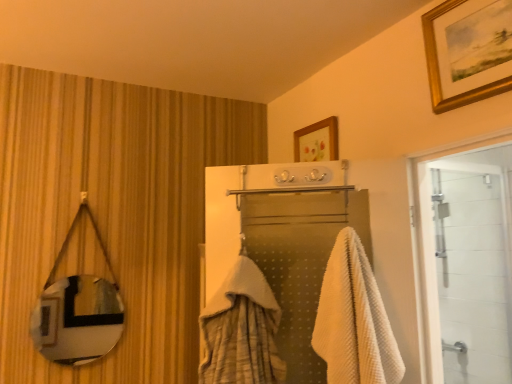
Locate an element on the screen. white glass door at right is located at coordinates (425, 244).

This screenshot has width=512, height=384. What do you see at coordinates (425, 244) in the screenshot? I see `white glass door at right` at bounding box center [425, 244].

What is the approximate width of gold-framed picture at upper right?

The width of gold-framed picture at upper right is 2.44 inches.

The height and width of the screenshot is (384, 512). Identify the location of white waffle towel at center. (354, 320).

Which is correct: white glass door at right is inside metallic reflective mirror at left, or outside of it?

The correct answer is: outside.

Is point (415, 291) less distant than point (88, 346)?

Yes, point (415, 291) is in front of point (88, 346).

Measure the distance from white glass door at right to metallic reflective mirror at left.

white glass door at right is 4.78 feet from metallic reflective mirror at left.

From the image's perspective, which one is positioned higher, white glass door at right or metallic reflective mirror at left?

From the image's view, white glass door at right is above.

Considering the relative sizes of white glass door at right and gold-framed picture at upper right in the image provided, is white glass door at right shorter than gold-framed picture at upper right?

In fact, white glass door at right may be taller than gold-framed picture at upper right.

From a real-world perspective, does white glass door at right sit lower than gold-framed picture at upper right?

Yes.

At what (x,y) coordinates should I click in order to perform the action: click on picture frame on the left of the white glass door at right. Please return your answer as a coordinate pair (x, y). Looking at the image, I should click on (454, 69).

Would you say metallic reflective mirror at left is part of white waffle towel at center's contents?

That's incorrect, metallic reflective mirror at left is not inside white waffle towel at center.

Which of these two, white waffle towel at center or metallic reflective mirror at left, is bigger?

With larger size is white waffle towel at center.

Is white waffle towel at center behind metallic reflective mirror at left?

That is False.

Is white waffle towel at center in contact with metallic reflective mirror at left?

They are not placed beside each other.

From a real-world perspective, between metallic reflective mirror at left and gold-framed picture at upper right, who is vertically lower?

metallic reflective mirror at left, from a real-world perspective.

From the image's perspective, is metallic reflective mirror at left under gold-framed picture at upper right?

Yes, from the image's perspective, metallic reflective mirror at left is beneath gold-framed picture at upper right.

Who is taller, metallic reflective mirror at left or gold-framed picture at upper right?

With more height is metallic reflective mirror at left.

Is metallic reflective mirror at left placed right next to gold-framed picture at upper right?

metallic reflective mirror at left is not next to gold-framed picture at upper right, and they're not touching.

From the picture: Considering the sizes of metallic reflective mirror at left and white waffle towel at center in the image, is metallic reflective mirror at left bigger or smaller than white waffle towel at center?

Considering their sizes, metallic reflective mirror at left takes up less space than white waffle towel at center.

Does metallic reflective mirror at left have a greater width compared to white waffle towel at center?

No.

Can you tell me how much metallic reflective mirror at left and white waffle towel at center differ in facing direction?

35.2 degrees separate the facing orientations of metallic reflective mirror at left and white waffle towel at center.

Considering the positions of objects metallic reflective mirror at left and white waffle towel at center in the image provided, who is behind, metallic reflective mirror at left or white waffle towel at center?

Positioned behind is metallic reflective mirror at left.

Considering the relative positions of white waffle towel at center and gold-framed picture at upper right in the image provided, is white waffle towel at center to the left or to the right of gold-framed picture at upper right?

Based on their positions, white waffle towel at center is located to the left of gold-framed picture at upper right.

Is white waffle towel at center next to gold-framed picture at upper right and touching it?

No.

Looking at their sizes, would you say white waffle towel at center is wider or thinner than gold-framed picture at upper right?

Clearly, white waffle towel at center has more width compared to gold-framed picture at upper right.

Could you tell me if white waffle towel at center is turned towards gold-framed picture at upper right?

No, white waffle towel at center is not facing towards gold-framed picture at upper right.

Considering the relative sizes of metallic reflective mirror at left and white glass door at right in the image provided, is metallic reflective mirror at left shorter than white glass door at right?

Yes.

Is metallic reflective mirror at left facing towards white glass door at right?

No, metallic reflective mirror at left is not facing towards white glass door at right.

Measure the distance between metallic reflective mirror at left and white glass door at right.

1.46 meters.

Who is bigger, metallic reflective mirror at left or white glass door at right?

With larger size is white glass door at right.

At what (x,y) coordinates should I click in order to perform the action: click on mirror below the white glass door at right (from a real-world perspective). Please return your answer as a coordinate pair (x, y). The image size is (512, 384). Looking at the image, I should click on (78, 309).

Locate an element on the screen. This screenshot has width=512, height=384. picture frame lying on the left of white glass door at right is located at coordinates (454, 69).

Estimate the real-world distances between objects in this image. Which object is further from white glass door at right, white waffle towel at center or metallic reflective mirror at left?

metallic reflective mirror at left.

Which object lies nearer to the anchor point gold-framed picture at upper right, white waffle towel at center or metallic reflective mirror at left?

Based on the image, white waffle towel at center appears to be nearer to gold-framed picture at upper right.

From the picture: Looking at the image, which one is located closer to gold-framed picture at upper right, metallic reflective mirror at left or white glass door at right?

The object closer to gold-framed picture at upper right is white glass door at right.

When comparing their distances from white waffle towel at center, does gold-framed picture at upper right or metallic reflective mirror at left seem closer?

gold-framed picture at upper right is closer to white waffle towel at center.

Looking at the image, which one is located closer to metallic reflective mirror at left, gold-framed picture at upper right or white glass door at right?

white glass door at right.

When comparing their distances from white glass door at right, does gold-framed picture at upper right or white waffle towel at center seem further?

Among the two, gold-framed picture at upper right is located further to white glass door at right.

Based on their spatial positions, is white glass door at right or metallic reflective mirror at left further from gold-framed picture at upper right?

The object further to gold-framed picture at upper right is metallic reflective mirror at left.

Based on their spatial positions, is white glass door at right or white waffle towel at center further from metallic reflective mirror at left?

white glass door at right.

Where is `towel between metallic reflective mirror at left and gold-framed picture at upper right from left to right`? This screenshot has height=384, width=512. towel between metallic reflective mirror at left and gold-framed picture at upper right from left to right is located at coordinates (354, 320).

Find the location of a particular element. The image size is (512, 384). towel between gold-framed picture at upper right and white glass door at right in the vertical direction is located at coordinates (354, 320).

Find the location of a particular element. The height and width of the screenshot is (384, 512). towel between metallic reflective mirror at left and white glass door at right from left to right is located at coordinates (354, 320).

Locate an element on the screen. picture frame between metallic reflective mirror at left and white glass door at right is located at coordinates (454, 69).